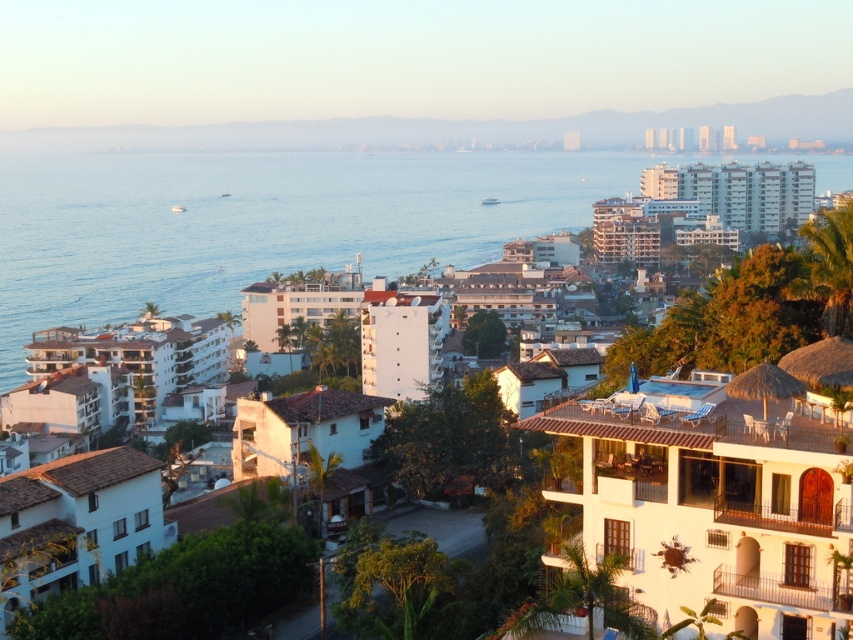
Question: Is blue water at center smaller than white stucco buildings at upper center?

Choices:
 (A) no
 (B) yes

Answer: (A)

Question: Which point is farther to the camera?

Choices:
 (A) white stucco buildings at upper center
 (B) blue water at center

Answer: (A)

Question: Which object appears closest to the camera in this image?

Choices:
 (A) blue water at center
 (B) white stucco buildings at upper center

Answer: (A)

Question: Is blue water at center bigger than white stucco buildings at upper center?

Choices:
 (A) yes
 (B) no

Answer: (A)

Question: Observing the image, what is the correct spatial positioning of blue water at center in reference to white stucco buildings at upper center?

Choices:
 (A) below
 (B) above

Answer: (A)